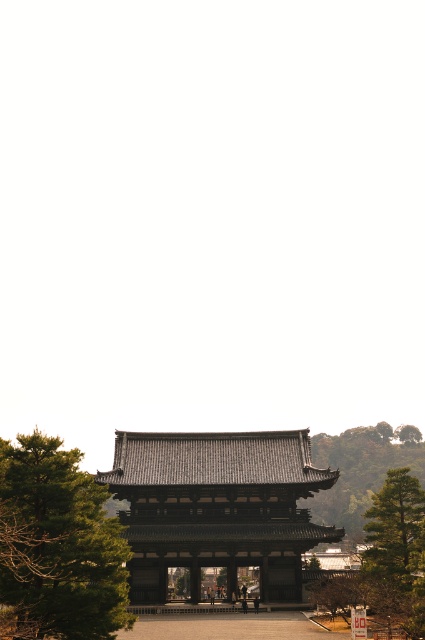
Who is positioned more to the right, green leafy tree at left or green textured tree at upper right?

green textured tree at upper right is more to the right.

Which is in front, point (68, 458) or point (336, 445)?

Point (68, 458) is more forward.

Where is `green leafy tree at left`? green leafy tree at left is located at coordinates (57, 545).

Is dark gray tiled gate at center positioned at the back of green leafy tree at left?

Yes, dark gray tiled gate at center is behind green leafy tree at left.

Find the location of `dark gray tiled gate at center`. dark gray tiled gate at center is located at coordinates (217, 508).

Is dark gray tiled gate at center thinner than green textured tree at upper right?

Correct, dark gray tiled gate at center's width is less than green textured tree at upper right's.

Who is more distant from viewer, (193, 596) or (379, 483)?

The point (379, 483) is more distant.

Is point (248, 538) positioned before point (365, 481)?

Yes, it is in front of point (365, 481).

The image size is (425, 640). What are the coordinates of `dark gray tiled gate at center` in the screenshot? It's located at (217, 508).